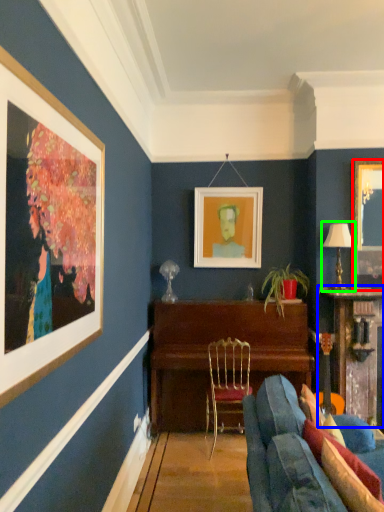
Question: Estimate the real-world distances between objects in this image. Which object is closer to picture frame (highlighted by a red box), table (highlighted by a blue box) or lamp (highlighted by a green box)?

Choices:
 (A) table
 (B) lamp

Answer: (B)